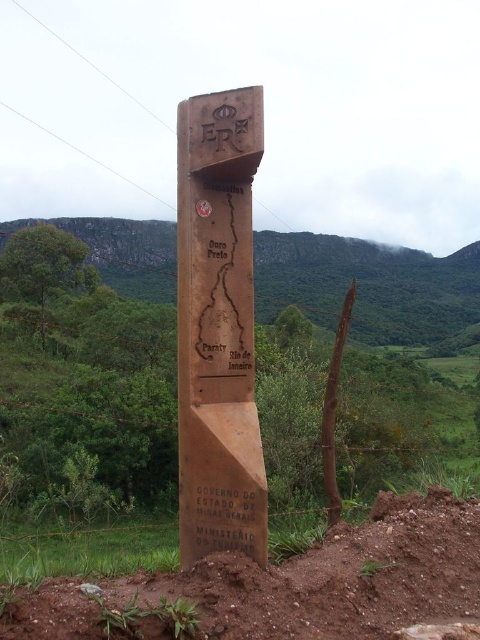
In the scene shown: You are a tourist standing in front of the brown wooden signpost at center and the black matte text at lower center. Which object is located more to the left?

The brown wooden signpost at center is positioned on the left side of black matte text at lower center, so it is more to the left.